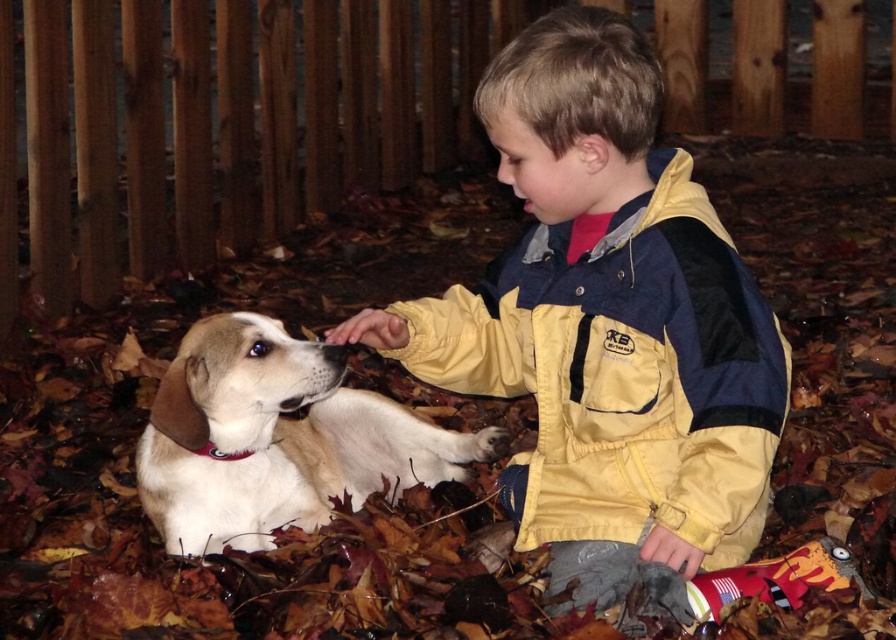
Is point (571, 266) positioned before point (225, 336)?

That is False.

Find the location of a particular element. The image size is (896, 640). yellow nylon jacket at center is located at coordinates (607, 316).